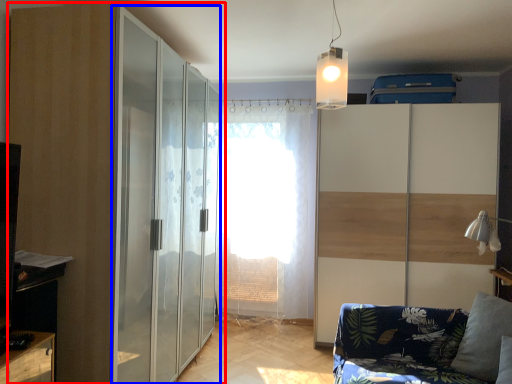
Question: Which of the following is the closest to the observer, door (highlighted by a red box) or screen door (highlighted by a blue box)?

Choices:
 (A) door
 (B) screen door

Answer: (A)